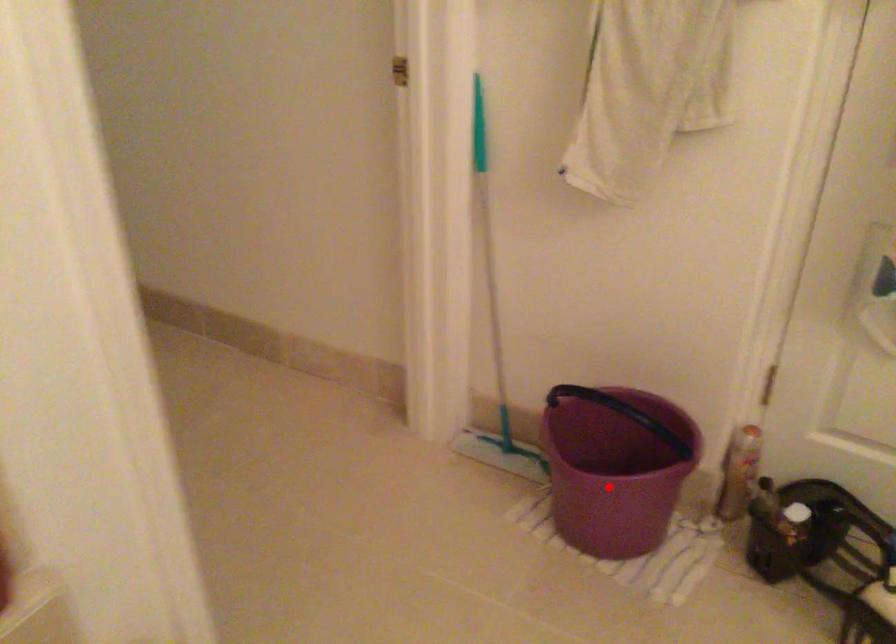
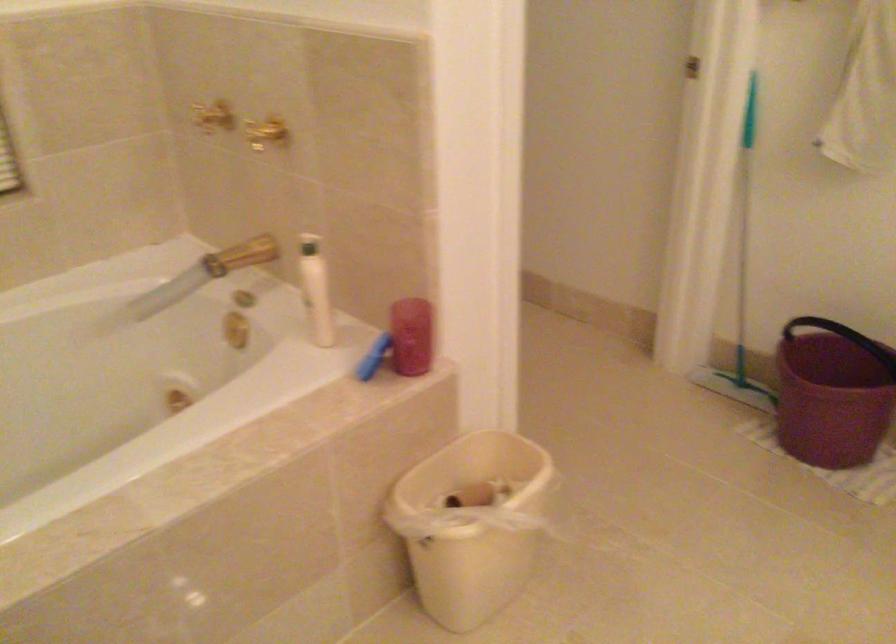
The point at the highlighted location is marked in the first image. Where is the corresponding point in the second image?

(831, 393)